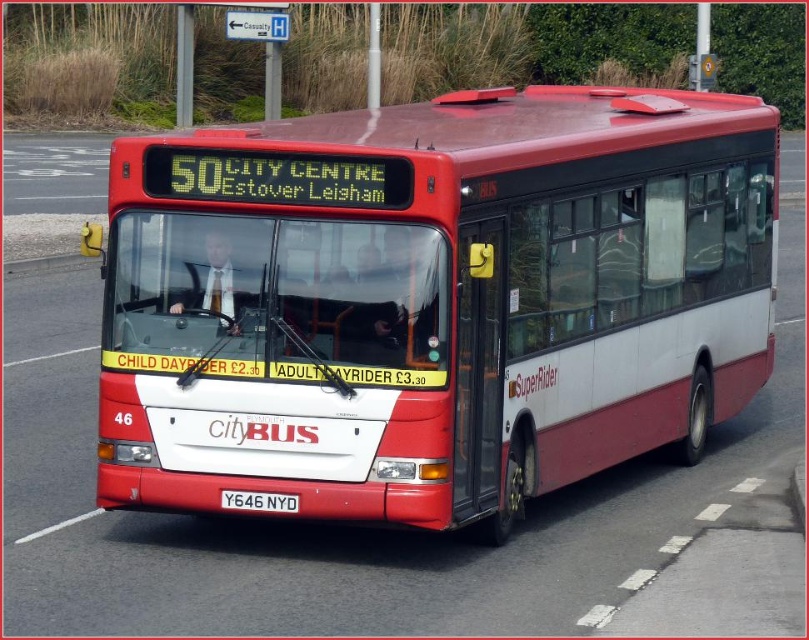
Question: Does matte red bus at center appear on the right side of white metallic license plate at center?

Choices:
 (A) yes
 (B) no

Answer: (B)

Question: Which object is positioned farthest from the white metallic license plate at center?

Choices:
 (A) matte red bus at center
 (B) metal signpost at upper center

Answer: (B)

Question: Can you confirm if matte red bus at center is wider than white metallic license plate at center?

Choices:
 (A) no
 (B) yes

Answer: (B)

Question: Can you confirm if matte red bus at center is positioned to the left of metal signpost at upper center?

Choices:
 (A) no
 (B) yes

Answer: (A)

Question: Which point is closer to the camera taking this photo?

Choices:
 (A) (178, 51)
 (B) (447, 490)

Answer: (B)

Question: Which is nearer to the metal signpost at upper center?

Choices:
 (A) white metallic license plate at center
 (B) matte red bus at center

Answer: (B)